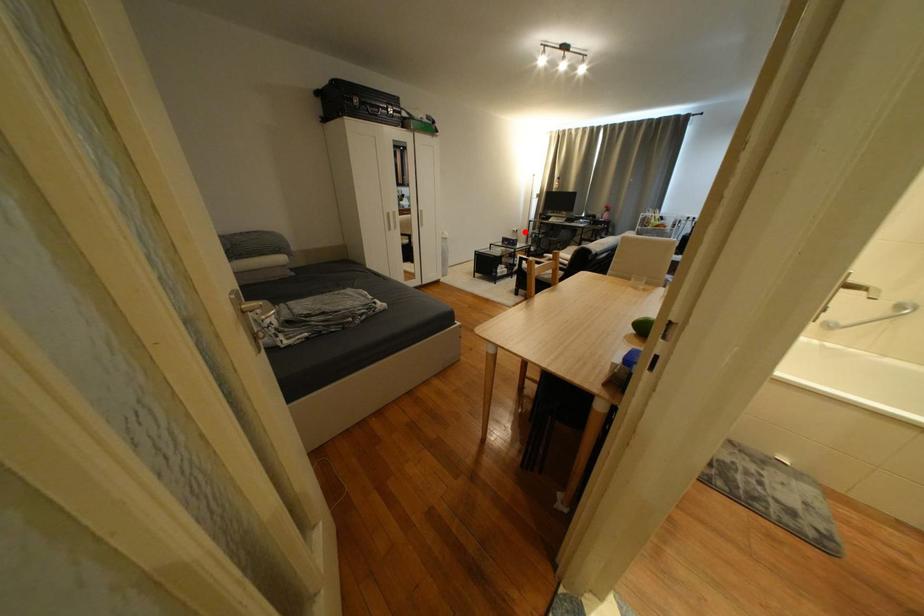
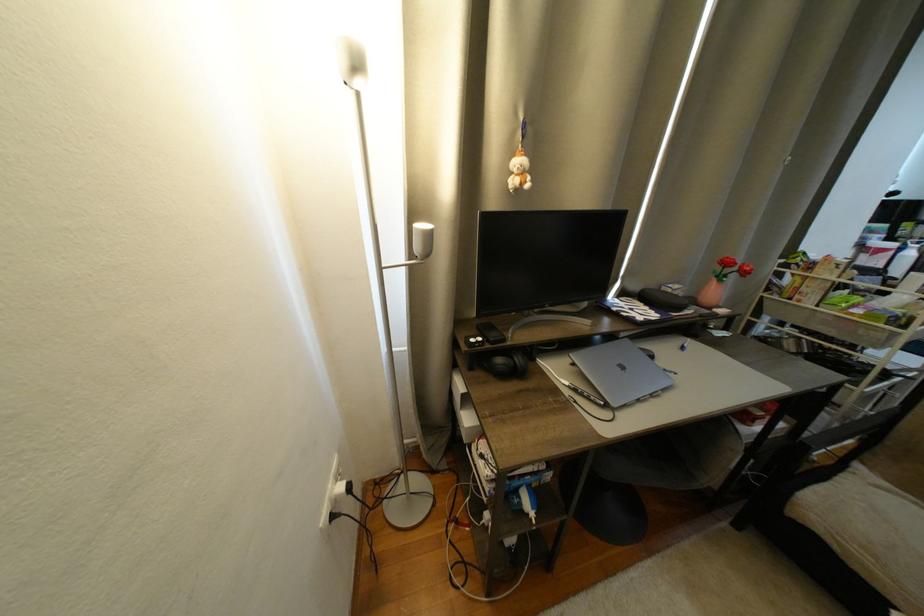
Question: A red point is marked in image1. In image2, is the corresponding 3D point closer to the camera or farther? Reply with the corresponding letter.

Choices:
 (A) The corresponding 3D point is closer.
 (B) The corresponding 3D point is farther.

Answer: (A)